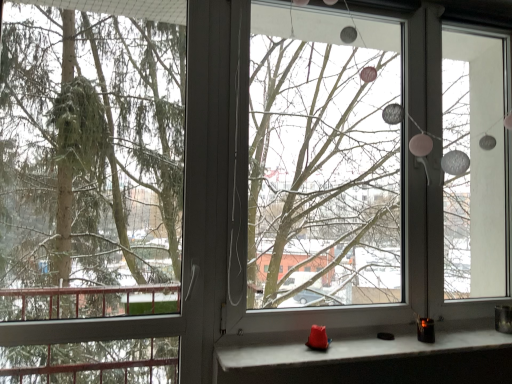
Question: Is matte white stone at lower center thinner than green matte tree at left?

Choices:
 (A) yes
 (B) no

Answer: (B)

Question: From the image's perspective, does matte white stone at lower center appear higher than green matte tree at left?

Choices:
 (A) no
 (B) yes

Answer: (A)

Question: From a real-world perspective, does matte white stone at lower center sit lower than green matte tree at left?

Choices:
 (A) yes
 (B) no

Answer: (A)

Question: Can you confirm if matte white stone at lower center is bigger than green matte tree at left?

Choices:
 (A) no
 (B) yes

Answer: (A)

Question: Can you confirm if matte white stone at lower center is smaller than green matte tree at left?

Choices:
 (A) no
 (B) yes

Answer: (B)

Question: From the image's perspective, is green matte tree at left positioned above or below transparent glass window screen at center?

Choices:
 (A) above
 (B) below

Answer: (B)

Question: Which is correct: green matte tree at left is inside transparent glass window screen at center, or outside of it?

Choices:
 (A) inside
 (B) outside

Answer: (B)

Question: In terms of width, does green matte tree at left look wider or thinner when compared to transparent glass window screen at center?

Choices:
 (A) thin
 (B) wide

Answer: (B)

Question: Is point (73, 182) closer or farther from the camera than point (378, 248)?

Choices:
 (A) closer
 (B) farther

Answer: (A)

Question: In terms of size, does transparent glass window screen at center appear bigger or smaller than matte white stone at lower center?

Choices:
 (A) small
 (B) big

Answer: (B)

Question: Is transparent glass window screen at center to the left or to the right of matte white stone at lower center in the image?

Choices:
 (A) left
 (B) right

Answer: (B)

Question: In terms of width, does transparent glass window screen at center look wider or thinner when compared to matte white stone at lower center?

Choices:
 (A) thin
 (B) wide

Answer: (A)

Question: From their relative heights in the image, would you say transparent glass window screen at center is taller or shorter than matte white stone at lower center?

Choices:
 (A) tall
 (B) short

Answer: (A)

Question: From a real-world perspective, is transparent glass window screen at center above or below green matte tree at left?

Choices:
 (A) above
 (B) below

Answer: (A)

Question: Does point (441, 59) appear closer or farther from the camera than point (122, 87)?

Choices:
 (A) closer
 (B) farther

Answer: (B)